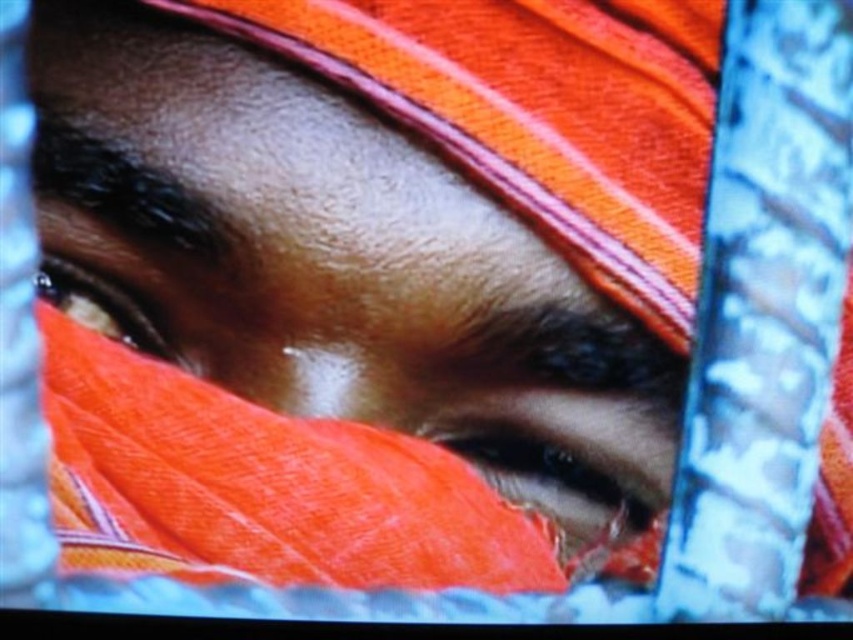
Question: Which point is closer to the camera?

Choices:
 (A) (140, 340)
 (B) (631, 534)
 (C) (386, 548)

Answer: (A)

Question: In this image, where is matte orange eye at center located relative to matte orange eye at upper left?

Choices:
 (A) above
 (B) below

Answer: (B)

Question: From the image, what is the correct spatial relationship of orange fabric at center in relation to matte orange eye at center?

Choices:
 (A) right
 (B) left

Answer: (B)

Question: Which of the following is the closest to the observer?

Choices:
 (A) (379, 492)
 (B) (614, 451)
 (C) (93, 324)

Answer: (C)

Question: Can you confirm if orange fabric at center is positioned to the left of matte orange eye at upper left?

Choices:
 (A) no
 (B) yes

Answer: (A)

Question: Which of the following is the farthest from the observer?

Choices:
 (A) (647, 504)
 (B) (91, 291)

Answer: (A)